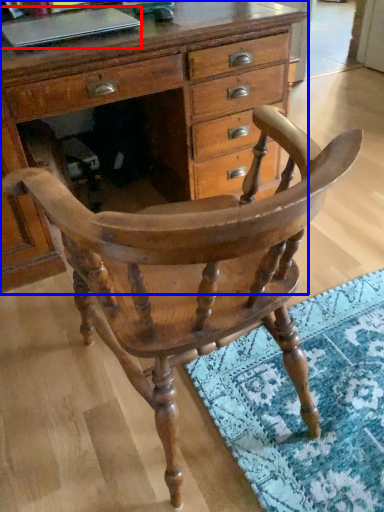
Question: Among these objects, which one is nearest to the camera, laptop (highlighted by a red box) or chest of drawers (highlighted by a blue box)?

Choices:
 (A) laptop
 (B) chest of drawers

Answer: (B)